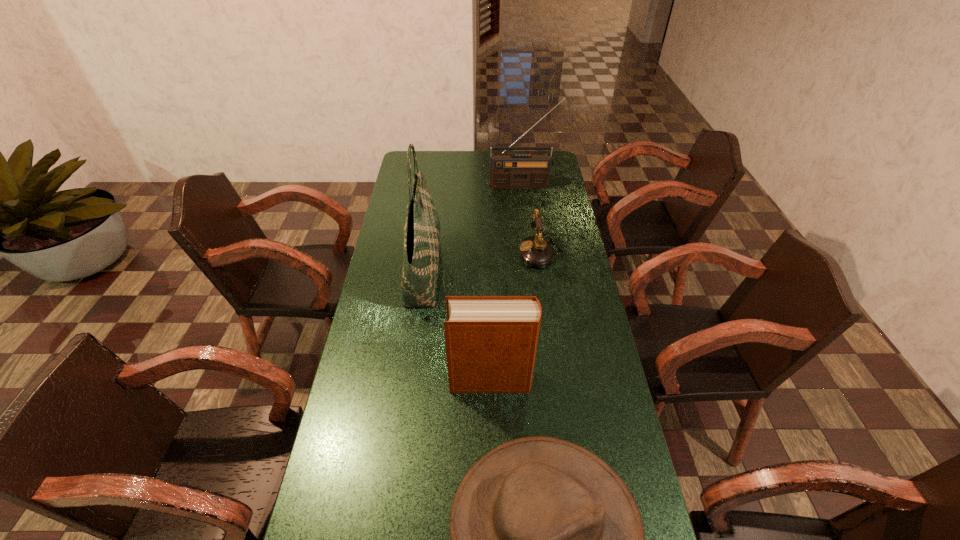
Find the location of a particular element. The width and height of the screenshot is (960, 540). free location at the right edge of the desktop is located at coordinates (548, 221).

In the image, there is a desktop. At what (x,y) coordinates should I click in order to perform the action: click on vacant space at the far left corner. Please return your answer as a coordinate pair (x, y). The image size is (960, 540). Looking at the image, I should click on (417, 158).

You are a GUI agent. You are given a task and a screenshot of the screen. Output one action in this format:
    pyautogui.click(x=<x>, y=<y>)
    Task: Click on the vacant point located between the fourth farthest object and the farthest object
    The height and width of the screenshot is (540, 960).
    Given the screenshot: What is the action you would take?
    pyautogui.click(x=507, y=282)

Locate an element on the screen. vacant area between the farthest object and the fourth tallest object is located at coordinates (532, 218).

Where is `object that can be found as the third closest to the shortest object`? This screenshot has height=540, width=960. object that can be found as the third closest to the shortest object is located at coordinates (535, 251).

Locate which object is the second closest to the tallest object. Please provide its 2D coordinates. Your answer should be formatted as a tuple, i.e. [(x, y)], where the tuple contains the x and y coordinates of a point satisfying the conditions above.

[(535, 251)]